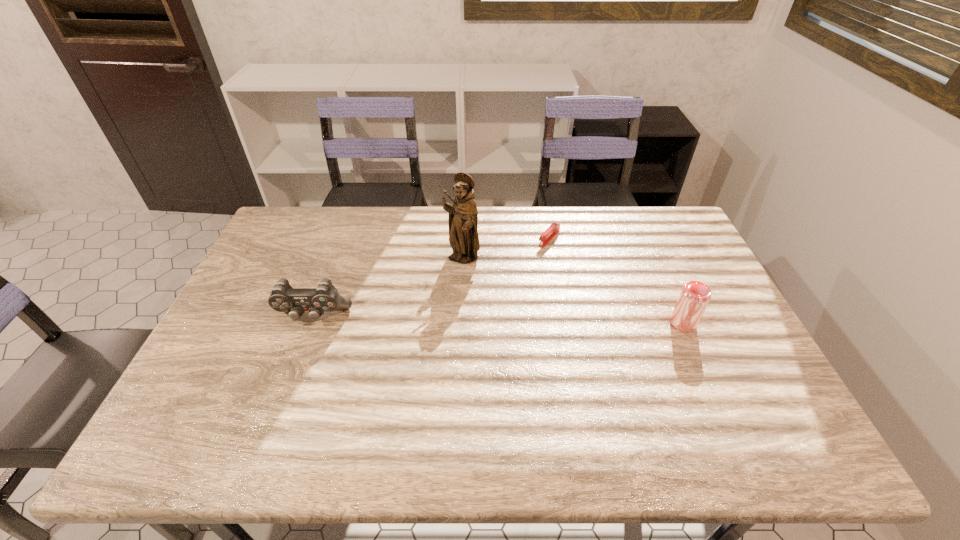
The width and height of the screenshot is (960, 540). Identify the location of control. (325, 298).

This screenshot has width=960, height=540. Find the location of `beer can`. beer can is located at coordinates (694, 297).

Where is `the shortest object`? Image resolution: width=960 pixels, height=540 pixels. the shortest object is located at coordinates (554, 228).

The width and height of the screenshot is (960, 540). What are the coordinates of `the third object from left to right` in the screenshot? It's located at pyautogui.click(x=554, y=228).

Locate an element on the screen. The height and width of the screenshot is (540, 960). the second object from left to right is located at coordinates (463, 216).

Find the location of `the tallest object`. the tallest object is located at coordinates (463, 216).

Find the location of `free space located on the surface of the control with buttons`. free space located on the surface of the control with buttons is located at coordinates (289, 382).

In order to click on blank area located 0.330m on the left of the beer can in this screenshot , I will do `click(552, 323)`.

Where is `vacant position located on the front-facing side of the shortest object`? This screenshot has height=540, width=960. vacant position located on the front-facing side of the shortest object is located at coordinates (506, 285).

Find the location of a particular element. The height and width of the screenshot is (540, 960). free spot located 0.110m on the front-facing side of the shortest object is located at coordinates (526, 264).